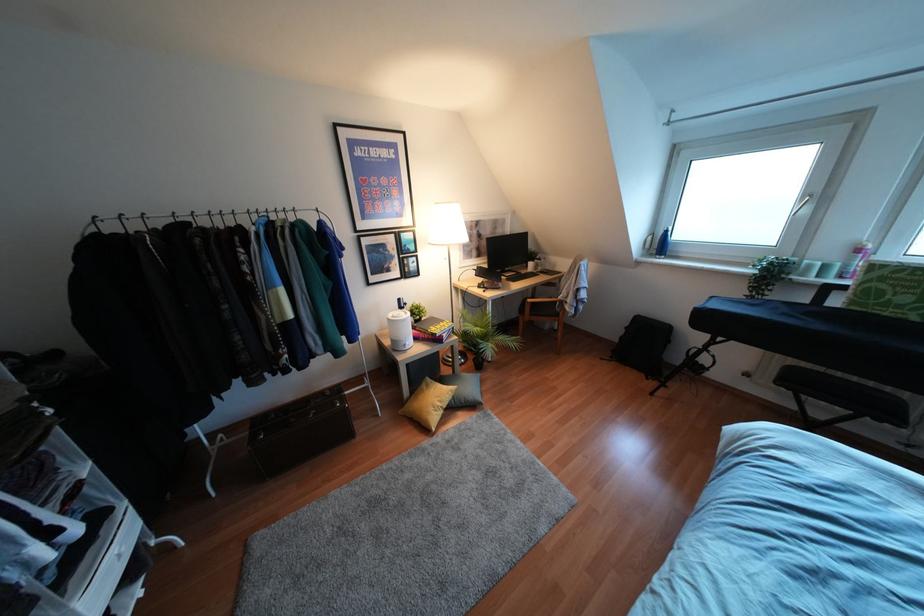
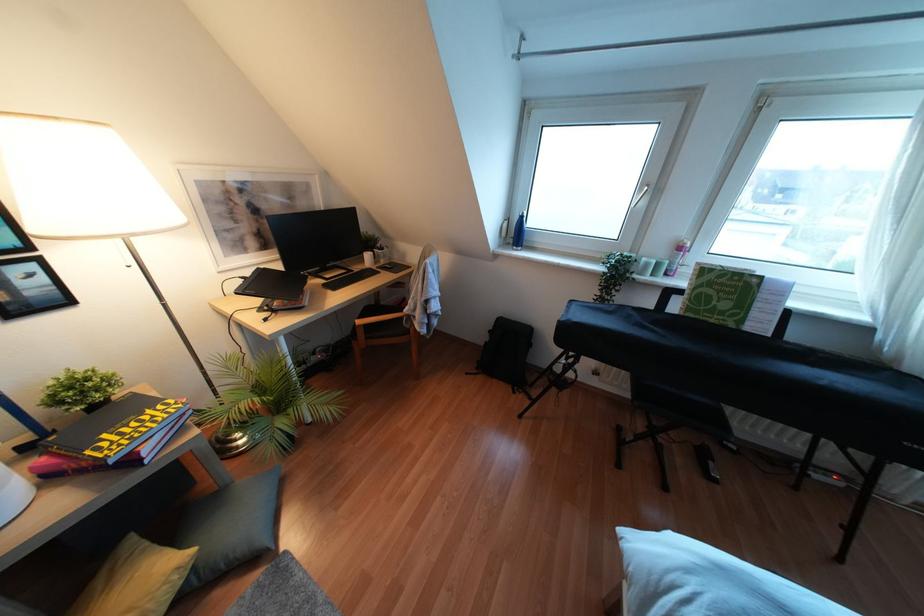
Question: How did the camera likely rotate?

Choices:
 (A) Left
 (B) Right
 (C) Up
 (D) Down

Answer: (B)